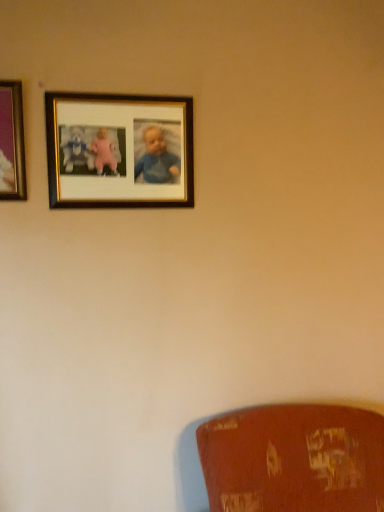
Question: Which direction should I rotate to look at wooden photo frame at upper center, which is the first picture frame from right to left?

Choices:
 (A) right
 (B) left

Answer: (B)

Question: Is wooden photo frame at upper center, which ranks as the 2th picture frame in front-to-back order, positioned far away from metallic silver frame at upper left, the second picture frame from the right?

Choices:
 (A) yes
 (B) no

Answer: (B)

Question: Can you confirm if wooden photo frame at upper center, which is the first picture frame from right to left, is positioned to the left of metallic silver frame at upper left, marked as the first picture frame in a front-to-back arrangement?

Choices:
 (A) no
 (B) yes

Answer: (A)

Question: From a real-world perspective, is wooden photo frame at upper center, which is the first picture frame from right to left, located higher than metallic silver frame at upper left, marked as the 2th picture frame in a back-to-front arrangement?

Choices:
 (A) yes
 (B) no

Answer: (B)

Question: From the image's perspective, does wooden photo frame at upper center, which ranks as the first picture frame in back-to-front order, appear lower than metallic silver frame at upper left, marked as the 2th picture frame in a back-to-front arrangement?

Choices:
 (A) no
 (B) yes

Answer: (B)

Question: Does wooden photo frame at upper center, which is the first picture frame from right to left, appear on the right side of metallic silver frame at upper left, marked as the 2th picture frame in a back-to-front arrangement?

Choices:
 (A) no
 (B) yes

Answer: (B)

Question: Is wooden photo frame at upper center, which ranks as the first picture frame in back-to-front order, shorter than metallic silver frame at upper left, the second picture frame from the right?

Choices:
 (A) yes
 (B) no

Answer: (B)

Question: From the image's perspective, is metallic silver frame at upper left, the first picture frame positioned from the left, located above wooden photo frame at upper center, which is the first picture frame from right to left?

Choices:
 (A) no
 (B) yes

Answer: (B)

Question: Is metallic silver frame at upper left, the first picture frame positioned from the left, next to wooden photo frame at upper center, which is the second picture frame from left to right, and touching it?

Choices:
 (A) no
 (B) yes

Answer: (A)

Question: Could wooden photo frame at upper center, which is the second picture frame from left to right, be considered to be inside metallic silver frame at upper left, the second picture frame from the right?

Choices:
 (A) yes
 (B) no

Answer: (B)

Question: Are metallic silver frame at upper left, marked as the 2th picture frame in a back-to-front arrangement, and wooden photo frame at upper center, which ranks as the 2th picture frame in front-to-back order, located far from each other?

Choices:
 (A) no
 (B) yes

Answer: (A)

Question: Considering the relative sizes of metallic silver frame at upper left, the first picture frame positioned from the left, and wooden photo frame at upper center, which ranks as the 2th picture frame in front-to-back order, in the image provided, is metallic silver frame at upper left, the first picture frame positioned from the left, taller than wooden photo frame at upper center, which ranks as the 2th picture frame in front-to-back order,?

Choices:
 (A) no
 (B) yes

Answer: (A)

Question: Does metallic silver frame at upper left, marked as the 2th picture frame in a back-to-front arrangement, come in front of wooden photo frame at upper center, which is the second picture frame from left to right?

Choices:
 (A) no
 (B) yes

Answer: (B)

Question: In the image, is metallic silver frame at upper left, the first picture frame positioned from the left, positioned in front of or behind wooden photo frame at upper center, which is the first picture frame from right to left?

Choices:
 (A) behind
 (B) front

Answer: (B)